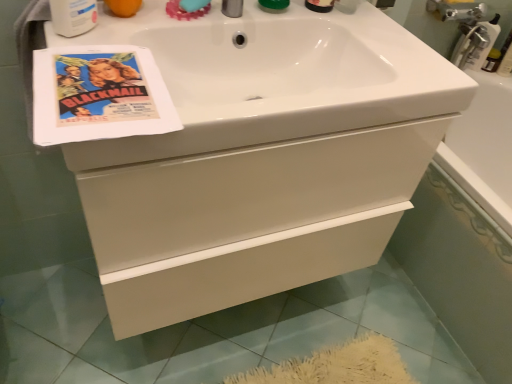
This screenshot has width=512, height=384. What do you see at coordinates (468, 231) in the screenshot?
I see `white glossy bathtub at lower right` at bounding box center [468, 231].

Describe the element at coordinates (73, 16) in the screenshot. The width and height of the screenshot is (512, 384). I see `white plastic mouthwash at upper left` at that location.

Image resolution: width=512 pixels, height=384 pixels. Find the location of `white glossy bathtub at lower right`. white glossy bathtub at lower right is located at coordinates (468, 231).

Considering their positions, is vintage paper flyer at upper left located in front of or behind teal rubber soap at upper center?

Visually, vintage paper flyer at upper left is located in front of teal rubber soap at upper center.

From the image's perspective, is vintage paper flyer at upper left positioned above or below teal rubber soap at upper center?

Clearly, from the image's perspective, vintage paper flyer at upper left is below teal rubber soap at upper center.

From a real-world perspective, between vintage paper flyer at upper left and teal rubber soap at upper center, who is vertically lower?

vintage paper flyer at upper left.

Which is more to the right, vintage paper flyer at upper left or teal rubber soap at upper center?

teal rubber soap at upper center.

Is white glossy bathtub at lower right shorter than white glossy cabinet at center?

Yes, white glossy bathtub at lower right is shorter than white glossy cabinet at center.

From a real-world perspective, between white glossy bathtub at lower right and white glossy cabinet at center, who is vertically higher?

From a 3D spatial view, white glossy cabinet at center is above.

From the image's perspective, which is below, white glossy bathtub at lower right or white glossy cabinet at center?

white glossy bathtub at lower right appears lower in the image.

Could you tell me if white glossy bathtub at lower right is turned towards white glossy cabinet at center?

Yes, white glossy bathtub at lower right faces towards white glossy cabinet at center.

Between white plastic mouthwash at upper left and white glossy bathtub at lower right, which one has larger width?

white glossy bathtub at lower right is wider.

Is white glossy bathtub at lower right at the back of white plastic mouthwash at upper left?

No.

Considering the relative sizes of white plastic mouthwash at upper left and white glossy bathtub at lower right in the image provided, is white plastic mouthwash at upper left smaller than white glossy bathtub at lower right?

Correct, white plastic mouthwash at upper left occupies less space than white glossy bathtub at lower right.

Is point (74, 10) closer or farther from the camera than point (511, 171)?

Clearly, point (74, 10) is closer to the camera than point (511, 171).

Is point (66, 23) closer or farther from the camera than point (100, 268)?

Point (66, 23) is closer to the camera than point (100, 268).

Which is behind, white plastic mouthwash at upper left or white glossy cabinet at center?

white plastic mouthwash at upper left is behind.

From the image's perspective, which one is positioned lower, white plastic mouthwash at upper left or white glossy cabinet at center?

white glossy cabinet at center appears lower in the image.

Looking at this image, from a real-world perspective, relative to white glossy cabinet at center, is white plastic mouthwash at upper left vertically above or below?

In terms of real-world spatial position, white plastic mouthwash at upper left is above white glossy cabinet at center.

Does teal rubber soap at upper center turn towards white glossy sink at upper center?

No, teal rubber soap at upper center is not facing towards white glossy sink at upper center.

Can you confirm if teal rubber soap at upper center is positioned to the left of white glossy sink at upper center?

Yes.

From a real-world perspective, is teal rubber soap at upper center beneath white glossy sink at upper center?

No, from a real-world perspective, teal rubber soap at upper center is not under white glossy sink at upper center.

Which is behind, teal rubber soap at upper center or white glossy sink at upper center?

teal rubber soap at upper center is further away from the camera.

Considering the sizes of vintage paper flyer at upper left and white glossy cabinet at center in the image, is vintage paper flyer at upper left taller or shorter than white glossy cabinet at center?

In the image, vintage paper flyer at upper left appears to be shorter than white glossy cabinet at center.

Would you consider vintage paper flyer at upper left to be distant from white glossy cabinet at center?

They are positioned close to each other.

In the scene shown: Is vintage paper flyer at upper left behind white glossy cabinet at center?

No, it is not.

Where is `mouthwash on the left side of white glossy bathtub at lower right`? This screenshot has height=384, width=512. mouthwash on the left side of white glossy bathtub at lower right is located at coordinates (73, 16).

Considering the sizes of objects white glossy bathtub at lower right and white plastic mouthwash at upper left in the image provided, who is smaller, white glossy bathtub at lower right or white plastic mouthwash at upper left?

white plastic mouthwash at upper left.

How much distance is there between white glossy bathtub at lower right and white plastic mouthwash at upper left?

1.19 meters.

How many degrees apart are the facing directions of white glossy bathtub at lower right and white plastic mouthwash at upper left?

There is a 130-degree angle between the facing directions of white glossy bathtub at lower right and white plastic mouthwash at upper left.

Image resolution: width=512 pixels, height=384 pixels. What are the coordinates of `soap on the right of vintage paper flyer at upper left` in the screenshot? It's located at (193, 5).

Find the location of a particular element. This screenshot has height=384, width=512. bath below the white glossy cabinet at center (from the image's perspective) is located at coordinates (468, 231).

From the image, which object appears to be nearer to vintage paper flyer at upper left, teal rubber soap at upper center or white glossy cabinet at center?

Based on the image, teal rubber soap at upper center appears to be nearer to vintage paper flyer at upper left.

Estimate the real-world distances between objects in this image. Which object is further from vintage paper flyer at upper left, white glossy bathtub at lower right or white plastic mouthwash at upper left?

white glossy bathtub at lower right is positioned further to the anchor vintage paper flyer at upper left.

Considering their positions, is teal rubber soap at upper center positioned closer to white plastic mouthwash at upper left than white glossy sink at upper center?

teal rubber soap at upper center.

From the image, which object appears to be farther from teal rubber soap at upper center, white glossy cabinet at center or white glossy sink at upper center?

white glossy cabinet at center lies further to teal rubber soap at upper center than the other object.

From the image, which object appears to be nearer to white glossy bathtub at lower right, vintage paper flyer at upper left or teal rubber soap at upper center?

vintage paper flyer at upper left is closer to white glossy bathtub at lower right.

Looking at this image, when comparing their distances from white glossy bathtub at lower right, does vintage paper flyer at upper left or white glossy sink at upper center seem further?

Among the two, vintage paper flyer at upper left is located further to white glossy bathtub at lower right.

Looking at this image, which object lies nearer to the anchor point teal rubber soap at upper center, white plastic mouthwash at upper left or white glossy cabinet at center?

white plastic mouthwash at upper left lies closer to teal rubber soap at upper center than the other object.

When comparing their distances from vintage paper flyer at upper left, does white glossy cabinet at center or white glossy bathtub at lower right seem closer?

white glossy cabinet at center lies closer to vintage paper flyer at upper left than the other object.

Find the location of a particular element. The height and width of the screenshot is (384, 512). mouthwash between teal rubber soap at upper center and white glossy cabinet at center from top to bottom is located at coordinates (73, 16).

Locate an element on the screen. The width and height of the screenshot is (512, 384). soap between white plastic mouthwash at upper left and white glossy bathtub at lower right from left to right is located at coordinates (193, 5).

This screenshot has width=512, height=384. I want to click on bathroom cabinet located between white plastic mouthwash at upper left and white glossy bathtub at lower right in the left-right direction, so click(x=248, y=219).

Find the location of a particular element. sink between vintage paper flyer at upper left and teal rubber soap at upper center in the front-back direction is located at coordinates (273, 78).